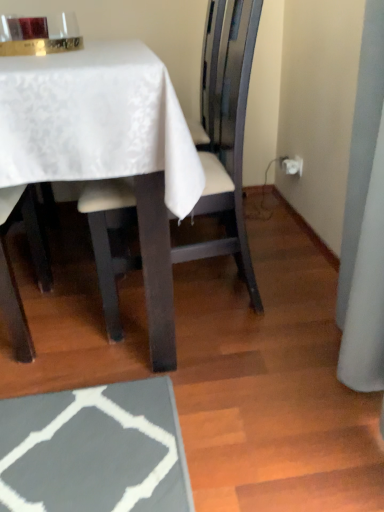
At what (x,y) coordinates should I click in order to perform the action: click on vacant space underneath white leather chair at center (from a real-world perspective). Please return your answer as a coordinate pair (x, y). Image resolution: width=384 pixels, height=512 pixels. Looking at the image, I should click on (211, 292).